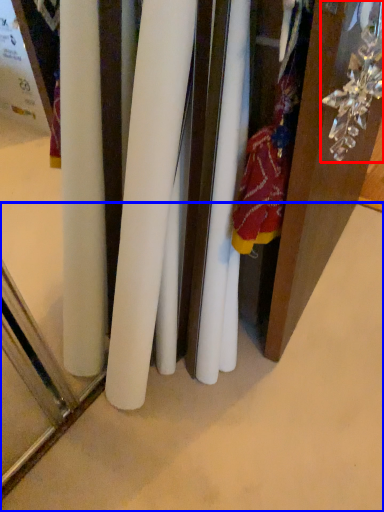
Question: Which object is closer to the camera taking this photo, accessory (highlighted by a red box) or surface (highlighted by a blue box)?

Choices:
 (A) accessory
 (B) surface

Answer: (A)